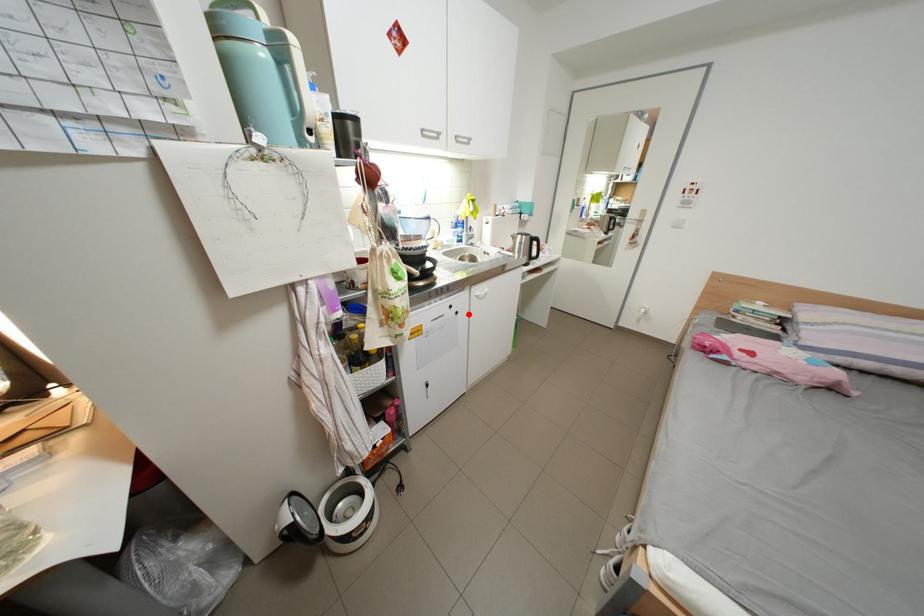
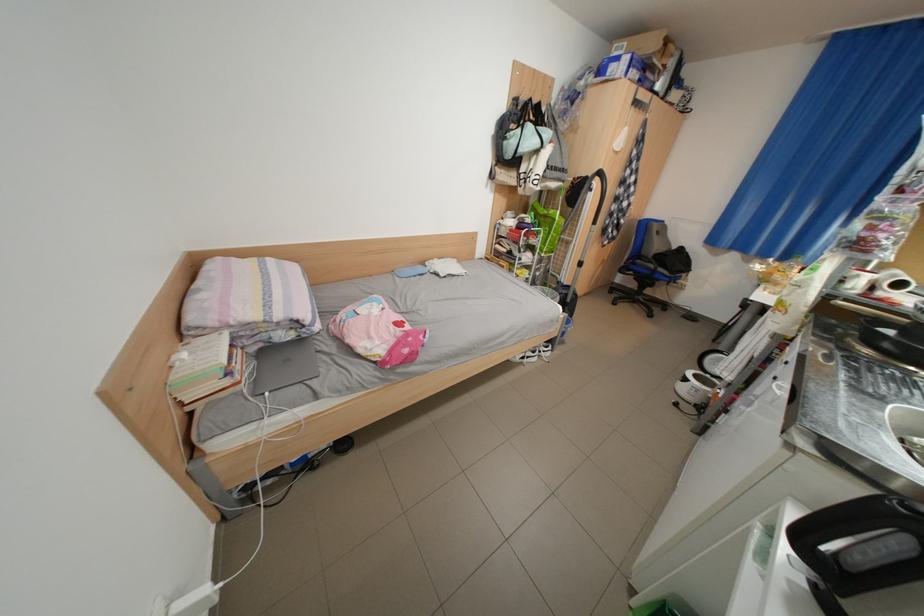
In the second image, find the point that corresponds to the highlighted location in the first image.

(786, 379)